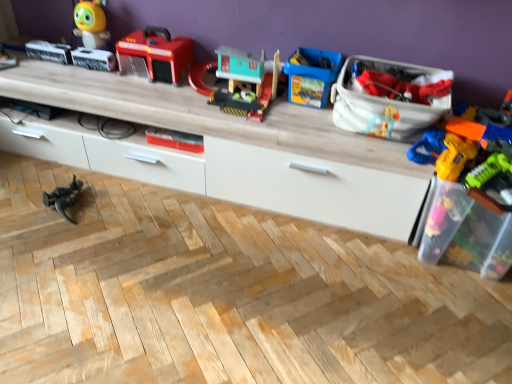
Where is `vacant space positioned to the left of matte plastic toy house at center, which is the 5th toy from left to right`? vacant space positioned to the left of matte plastic toy house at center, which is the 5th toy from left to right is located at coordinates (150, 92).